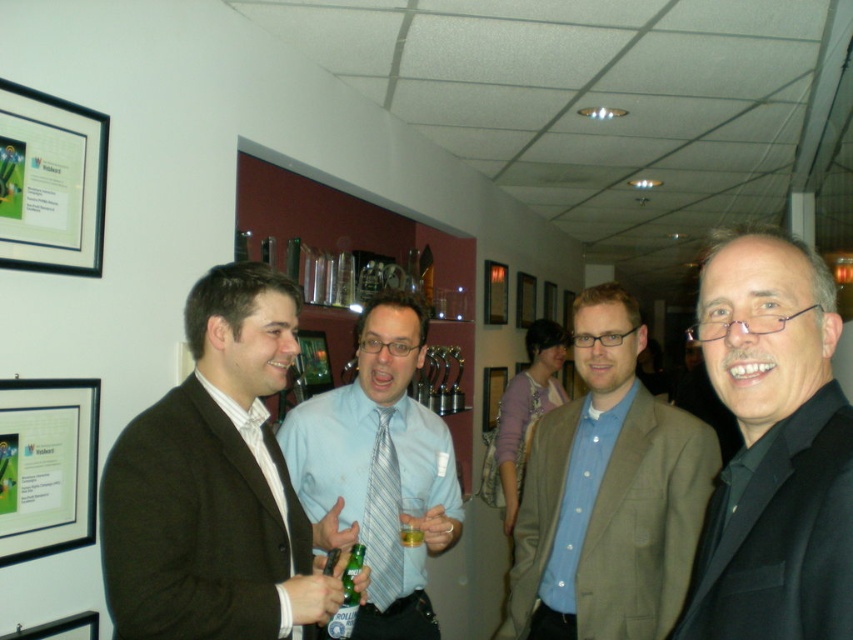
Is matte black frame at left wider than translucent glass beer at center?

Indeed, matte black frame at left has a greater width compared to translucent glass beer at center.

Can you confirm if matte black frame at left is bigger than translucent glass beer at center?

Yes.

Describe the element at coordinates (45, 465) in the screenshot. I see `matte black frame at left` at that location.

Find the location of a particular element. This screenshot has height=640, width=853. matte black frame at left is located at coordinates [45, 465].

Between light blue striped tie at center and striped fabric tie at center, which one is positioned higher?

Positioned higher is light blue striped tie at center.

Does light blue striped tie at center come behind striped fabric tie at center?

No, light blue striped tie at center is in front of striped fabric tie at center.

Which is behind, point (403, 296) or point (386, 518)?

Positioned behind is point (403, 296).

This screenshot has width=853, height=640. I want to click on light blue striped tie at center, so click(379, 468).

Between point (128, 560) and point (352, 548), which one is positioned in front?

Point (128, 560) is more forward.

Between brown wool suit at center and green glass bottle at center, which one has less height?

green glass bottle at center

Is point (216, 552) closer to viewer compared to point (346, 616)?

Yes, point (216, 552) is closer to viewer.

What are the coordinates of `brown wool suit at center` in the screenshot? It's located at 213,483.